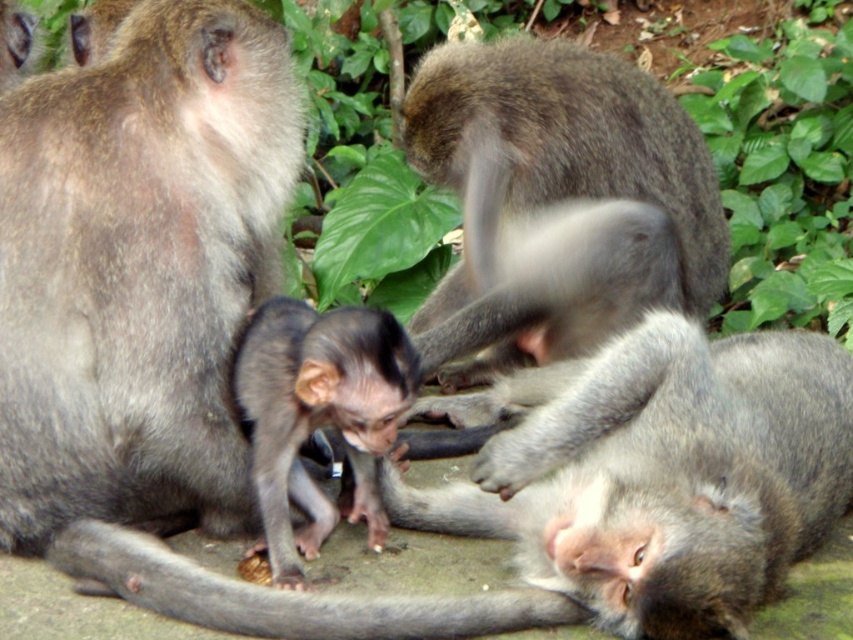
Measure the distance from gray fur monkey at lower right to dark gray fur monkey at center.

They are 12.99 inches apart.

Who is taller, gray fur monkey at lower right or dark gray fur monkey at center?

With more height is gray fur monkey at lower right.

Locate an element on the screen. The height and width of the screenshot is (640, 853). gray fur monkey at lower right is located at coordinates (659, 474).

This screenshot has height=640, width=853. Identify the location of gray fur monkey at lower right. (659, 474).

The width and height of the screenshot is (853, 640). Describe the element at coordinates (659, 474) in the screenshot. I see `gray fur monkey at lower right` at that location.

In order to click on gray fur monkey at lower right in this screenshot , I will do `click(659, 474)`.

Who is more distant from viewer, (660, 189) or (265, 506)?

The point (660, 189) is more distant.

Which is in front, point (534, 209) or point (311, 400)?

Point (311, 400) is in front.

Is point (480, 362) positioned in front of point (248, 355)?

No, it is behind (248, 355).

Image resolution: width=853 pixels, height=640 pixels. I want to click on gray furry monkey at upper center, so click(x=556, y=202).